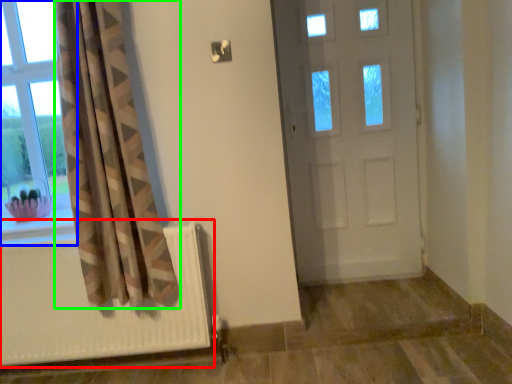
Question: Considering the real-world distances, which object is farthest from radiator (highlighted by a red box)? window (highlighted by a blue box) or curtain (highlighted by a green box)?

Choices:
 (A) window
 (B) curtain

Answer: (A)